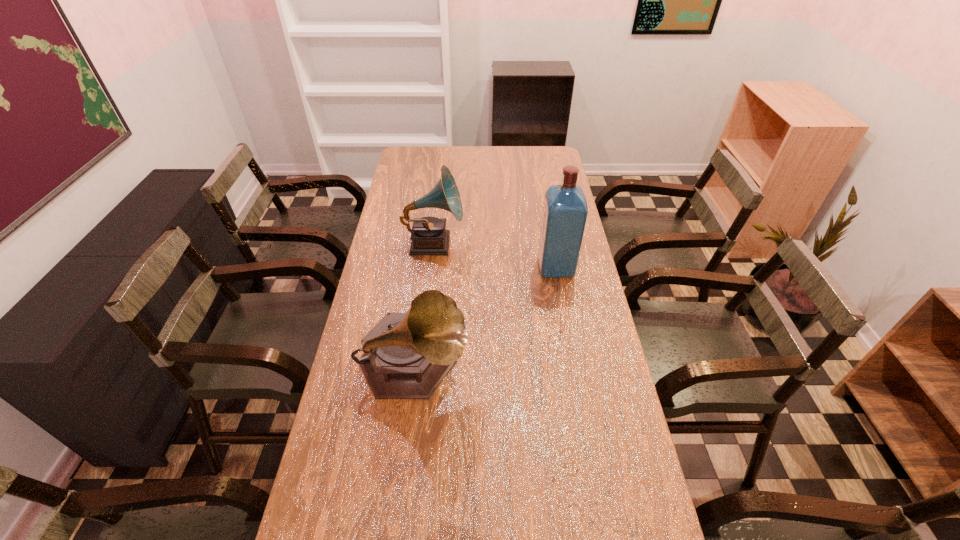
This screenshot has height=540, width=960. What are the coordinates of `the tallest object` in the screenshot? It's located at (565, 210).

Identify the location of the rightmost object. (565, 210).

Identify the location of the farther phonograph record. (429, 236).

What are the coordinates of `the nearest object` in the screenshot? It's located at (407, 355).

This screenshot has width=960, height=540. In order to click on vacant region located on the flat label side of the rightmost object in this screenshot , I will do `click(432, 267)`.

Find the location of a particular element. The image size is (960, 540). vacant space located 0.210m on the flat label side of the rightmost object is located at coordinates (478, 267).

You are a GUI agent. You are given a task and a screenshot of the screen. Output one action in this format:
    pyautogui.click(x=<x>, y=<y>)
    Task: Click on the vacant area situated 0.370m on the flat label side of the rightmost object
    This screenshot has height=540, width=960.
    Given the screenshot: What is the action you would take?
    (432, 267)

Locate an element on the screen. The height and width of the screenshot is (540, 960). vacant space located from the horn of the farther phonograph record is located at coordinates (505, 243).

Locate an element on the screen. vacant space located 0.190m on the horn direction of the nearest object is located at coordinates (537, 367).

Locate an element on the screen. The height and width of the screenshot is (540, 960). object that is at the right edge is located at coordinates (565, 210).